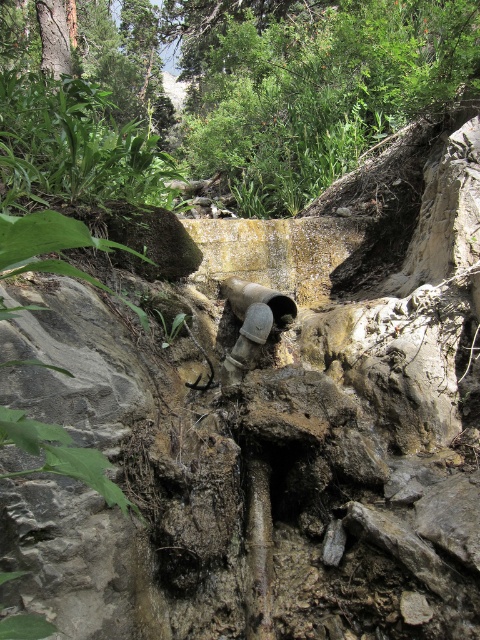
Looking at this image, you are standing at the point marked by the coordinates point [226,93]. Looking around, you see a green leafy tree at upper center. Which direction should you face to look towards the green leafy tree at upper center?

The point [226,93] corresponds to the green leafy tree at upper center, so you are already facing the tree. Face forward to look towards the green leafy tree at upper center.

You are a landscape architect designing a garden path that needs to pass between the green leafy tree at upper center and the matte gray water pipe at center. Given the space constraints, can the path be wide enough for a standard wheelchair to pass through comfortably?

The green leafy tree at upper center has a larger width than the matte gray water pipe at center. Since the tree is wider, the available space between them might still accommodate a wheelchair path, but the exact feasibility depends on the minimum width requirement of the wheelchair. However, based on the description, the tree is wider, so the path width could be narrower near the tree but wider near the pipe. It is advisable to measure the narrowest point between them to ensure it meets accessibility norms

You are a hiker navigating through the rocky terrain and want to reach the drainage pipe. You notice two points marked on your map at coordinates point (348, 19) and point (239, 308). Which point should you head towards first if you want to approach the drainage pipe from the front?

You should head towards point (239, 308) first because point (348, 19) is behind it, meaning the drainage pipe is likely in front of point (239, 308).